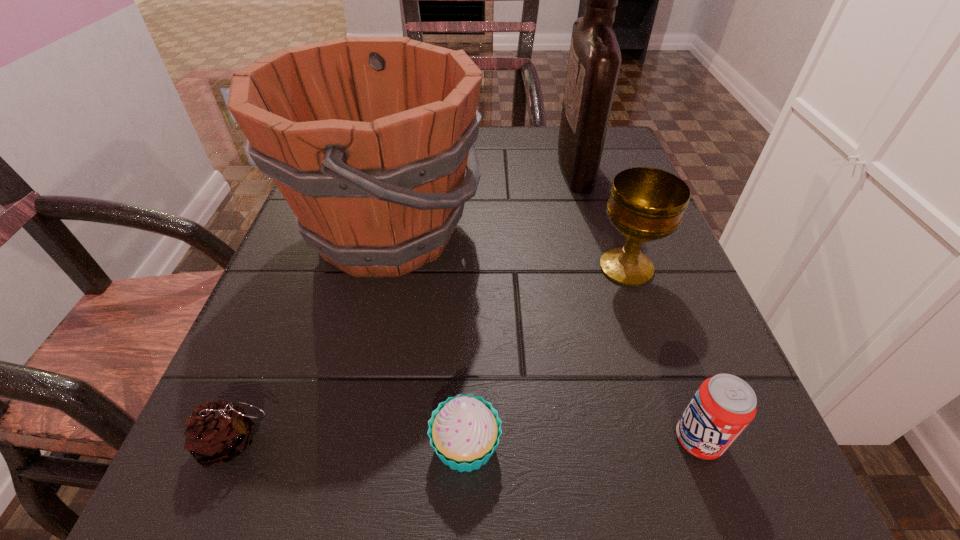
Identify the location of vacant region located 0.100m on the front of the chalice. The image size is (960, 540). (651, 341).

Image resolution: width=960 pixels, height=540 pixels. I want to click on vacant space located on the surface of the soda can, so click(358, 439).

Where is `blank area located on the surface of the soda can`? The image size is (960, 540). blank area located on the surface of the soda can is located at coordinates (447, 439).

Identify the location of vacant space situated on the surface of the soda can. (447, 439).

At what (x,y) coordinates should I click in order to perform the action: click on blank area located 0.360m on the back of the cupcake. Please return your answer as a coordinate pair (x, y). This screenshot has width=960, height=540. Looking at the image, I should click on (470, 234).

What are the coordinates of `vacant region located with a leaf charm attached to the shortest object` in the screenshot? It's located at pos(335,443).

Identify the location of liquor at the far edge. The image size is (960, 540). (594, 62).

The height and width of the screenshot is (540, 960). I want to click on bucket at the far edge, so click(x=368, y=138).

This screenshot has width=960, height=540. I want to click on cupcake situated at the near edge, so click(464, 431).

The height and width of the screenshot is (540, 960). I want to click on pinecone that is at the near edge, so click(217, 432).